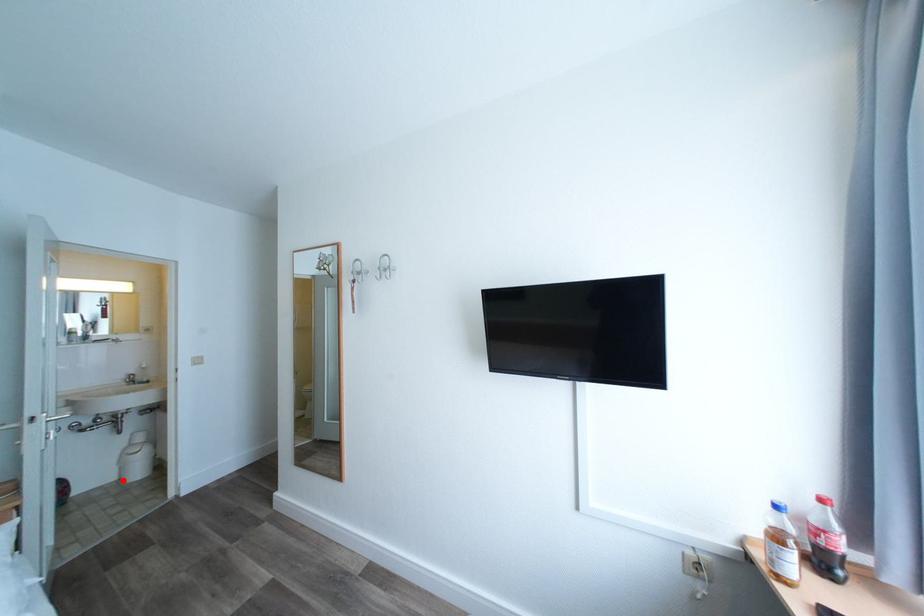
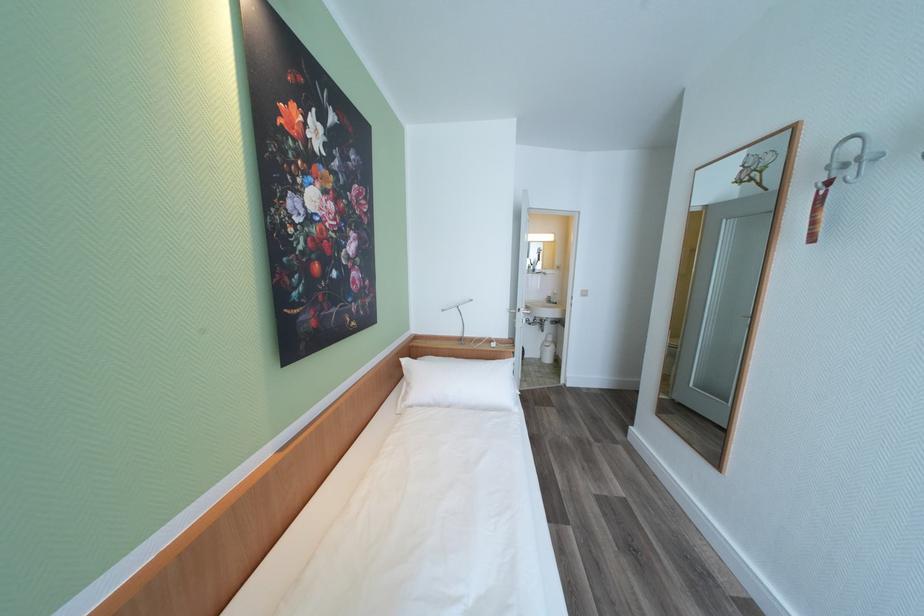
Question: A red point is marked in image1. In image2, is the corresponding 3D point closer to the camera or farther? Reply with the corresponding letter.

Choices:
 (A) The corresponding 3D point is closer.
 (B) The corresponding 3D point is farther.

Answer: (B)